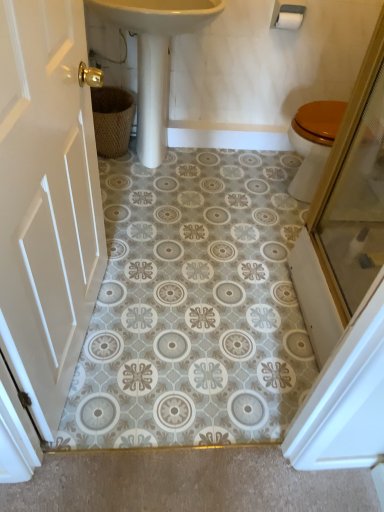
Question: Is white wood door at left turned away from white matte toilet paper at upper right?

Choices:
 (A) no
 (B) yes

Answer: (A)

Question: Is the surface of white wood door at left in direct contact with white matte toilet paper at upper right?

Choices:
 (A) no
 (B) yes

Answer: (A)

Question: From a real-world perspective, is white wood door at left physically above white matte toilet paper at upper right?

Choices:
 (A) no
 (B) yes

Answer: (A)

Question: Can you confirm if white wood door at left is bigger than white matte toilet paper at upper right?

Choices:
 (A) no
 (B) yes

Answer: (B)

Question: Can you confirm if white wood door at left is shorter than white matte toilet paper at upper right?

Choices:
 (A) yes
 (B) no

Answer: (B)

Question: In the image, is white matte toilet paper at upper right on the left side or the right side of woven brown basket at left?

Choices:
 (A) left
 (B) right

Answer: (B)

Question: In terms of width, does white matte toilet paper at upper right look wider or thinner when compared to woven brown basket at left?

Choices:
 (A) thin
 (B) wide

Answer: (A)

Question: Do you think white matte toilet paper at upper right is within woven brown basket at left, or outside of it?

Choices:
 (A) inside
 (B) outside

Answer: (B)

Question: Is point (281, 10) closer or farther from the camera than point (102, 108)?

Choices:
 (A) closer
 (B) farther

Answer: (A)

Question: In terms of width, does woven brown basket at left look wider or thinner when compared to white matte toilet paper at upper right?

Choices:
 (A) thin
 (B) wide

Answer: (B)

Question: From a real-world perspective, is woven brown basket at left above or below white matte toilet paper at upper right?

Choices:
 (A) above
 (B) below

Answer: (B)

Question: Which is correct: woven brown basket at left is inside white matte toilet paper at upper right, or outside of it?

Choices:
 (A) inside
 (B) outside

Answer: (B)

Question: Is woven brown basket at left taller or shorter than white matte toilet paper at upper right?

Choices:
 (A) short
 (B) tall

Answer: (B)

Question: In the image, is white wood door at left on the left side or the right side of white glossy sink at center?

Choices:
 (A) right
 (B) left

Answer: (B)

Question: From a real-world perspective, is white wood door at left above or below white glossy sink at center?

Choices:
 (A) below
 (B) above

Answer: (B)